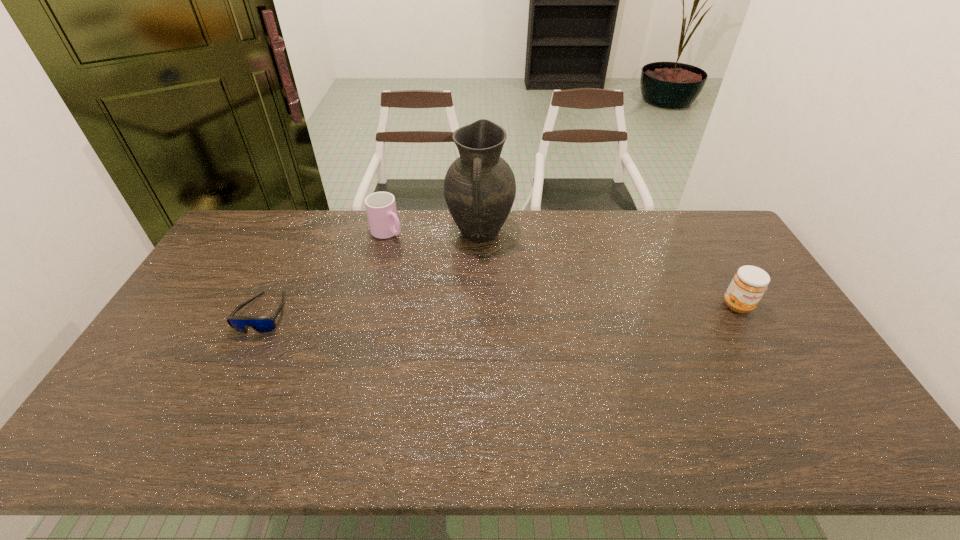
At what (x,y) coordinates should I click in order to perform the action: click on empty space that is in between the shortest object and the rightmost object. Please return your answer as a coordinate pair (x, y). The image size is (960, 540). Looking at the image, I should click on (500, 309).

You are a GUI agent. You are given a task and a screenshot of the screen. Output one action in this format:
    pyautogui.click(x=<x>, y=<y>)
    Task: Click on the free space that is in between the shortest object and the rightmost object
    This screenshot has width=960, height=540.
    Given the screenshot: What is the action you would take?
    pyautogui.click(x=500, y=309)

Select which object is the third closest to the sunglasses. Please provide its 2D coordinates. Your answer should be formatted as a tuple, i.e. [(x, y)], where the tuple contains the x and y coordinates of a point satisfying the conditions above.

[(749, 284)]

Choose which object is the nearest neighbor to the second object from left to right. Please provide its 2D coordinates. Your answer should be formatted as a tuple, i.e. [(x, y)], where the tuple contains the x and y coordinates of a point satisfying the conditions above.

[(479, 187)]